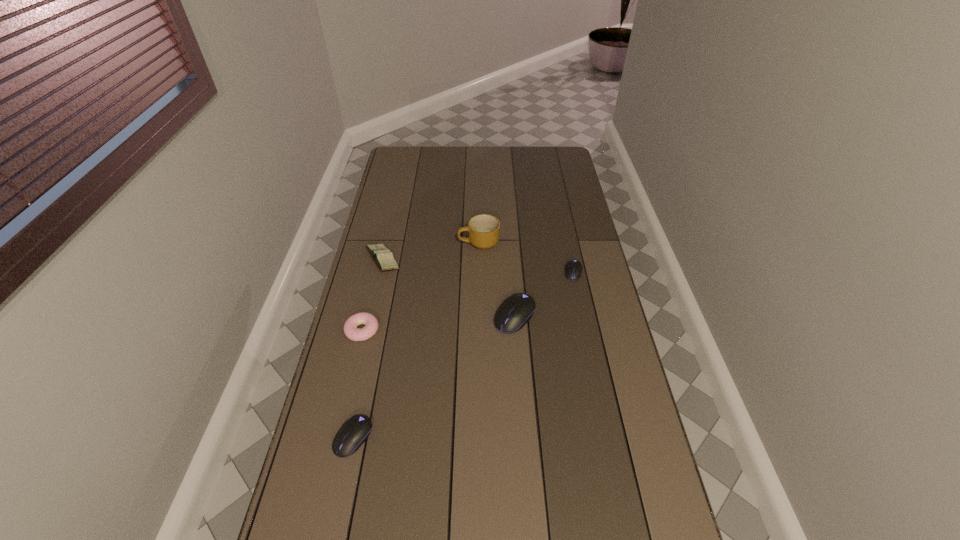
Where is `vacant position located 0.120m on the front of the second nearest computer mouse`? This screenshot has width=960, height=540. vacant position located 0.120m on the front of the second nearest computer mouse is located at coordinates (518, 366).

You are a GUI agent. You are given a task and a screenshot of the screen. Output one action in this format:
    pyautogui.click(x=<x>, y=<y>)
    Task: Click on the vacant space situated on the front of the shortest computer mouse
    The image size is (960, 540).
    Given the screenshot: What is the action you would take?
    pyautogui.click(x=581, y=306)

Locate an element on the screen. The height and width of the screenshot is (540, 960). vacant space located 0.210m on the back of the diary is located at coordinates (394, 214).

You are a GUI agent. You are given a task and a screenshot of the screen. Output one action in this format:
    pyautogui.click(x=<x>, y=<y>)
    Task: Click on the free space located on the front of the doughnut
    The width and height of the screenshot is (960, 540).
    Given the screenshot: What is the action you would take?
    pyautogui.click(x=332, y=457)

You are a GUI agent. You are given a task and a screenshot of the screen. Output one action in this format:
    pyautogui.click(x=<x>, y=<y>)
    Task: Click on the free region located on the side with the handle of the mug
    The image size is (960, 540).
    Given the screenshot: What is the action you would take?
    pyautogui.click(x=384, y=242)

Where is `free space located 0.090m on the side with the handle of the mug`? free space located 0.090m on the side with the handle of the mug is located at coordinates (436, 242).

What are the coordinates of `vacant region located 0.290m on the side with the handle of the mug` in the screenshot? It's located at (387, 242).

Find the location of a particular element. The image size is (960, 540). computer mouse that is at the left edge is located at coordinates (354, 432).

The height and width of the screenshot is (540, 960). I want to click on diary situated at the left edge, so click(x=383, y=257).

Where is `doughnut that is positioned at the left edge`? The image size is (960, 540). doughnut that is positioned at the left edge is located at coordinates (351, 331).